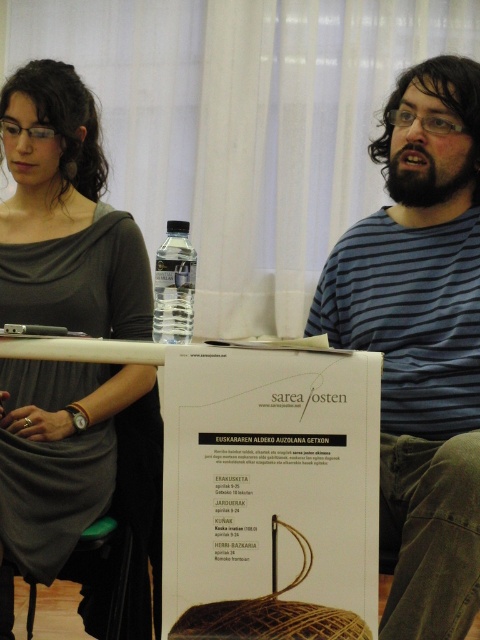
Who is higher up, white paper poster at center or matte gray dress at upper left?

Positioned higher is matte gray dress at upper left.

Who is more distant from viewer, (212, 552) or (36, 316)?

Positioned behind is point (36, 316).

Describe the element at coordinates (269, 490) in the screenshot. The image size is (480, 640). I see `white paper poster at center` at that location.

You are a GUI agent. You are given a task and a screenshot of the screen. Output one action in this format:
    pyautogui.click(x=<x>, y=<y>)
    Task: Click on the white paper poster at center
    
    Given the screenshot: What is the action you would take?
    pyautogui.click(x=269, y=490)

Is blue striped shirt at center bigger than matte gray dress at upper left?

Actually, blue striped shirt at center might be smaller than matte gray dress at upper left.

Image resolution: width=480 pixels, height=640 pixels. What are the coordinates of `blue striped shirt at center` in the screenshot? It's located at (420, 342).

Does blue striped shirt at center appear on the left side of white paper poster at center?

In fact, blue striped shirt at center is to the right of white paper poster at center.

Who is higher up, blue striped shirt at center or white paper poster at center?

Positioned higher is blue striped shirt at center.

Where is `blue striped shirt at center`? The image size is (480, 640). blue striped shirt at center is located at coordinates (420, 342).

Identify the location of blue striped shirt at center. This screenshot has width=480, height=640. (420, 342).